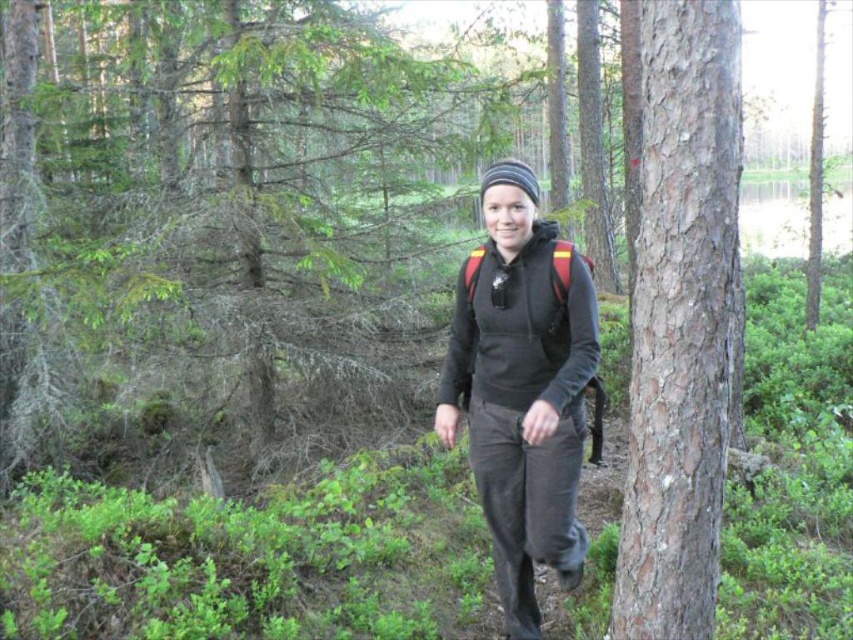
The height and width of the screenshot is (640, 853). In order to click on smooth brown bark at center in this screenshot , I will do `click(682, 321)`.

Between point (659, 244) and point (457, 321), which one is positioned in front?

Positioned in front is point (659, 244).

Image resolution: width=853 pixels, height=640 pixels. I want to click on smooth brown bark at center, so click(682, 321).